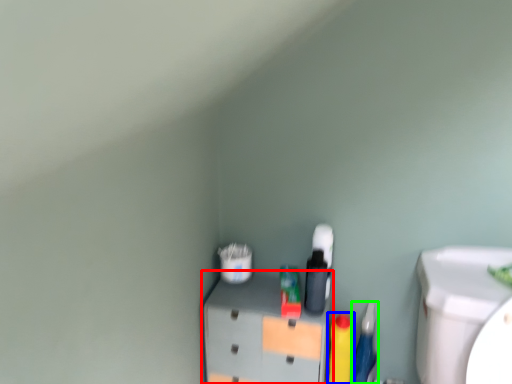
Question: Estimate the real-world distances between objects in this image. Which object is farther from furniture (highlighted by a red box), cleaning product (highlighted by a blue box) or stationery (highlighted by a green box)?

Choices:
 (A) cleaning product
 (B) stationery

Answer: (B)